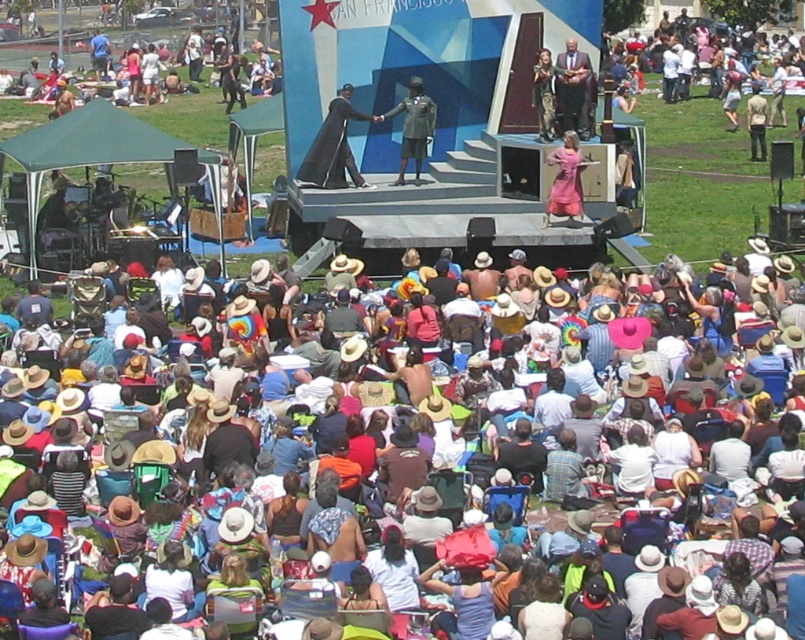
Question: Is brown straw hats at center bigger than metallic silver statue at center?

Choices:
 (A) no
 (B) yes

Answer: (B)

Question: Which object is positioned closest to the metallic silver statue at center?

Choices:
 (A) smooth brown suit at center
 (B) brown straw hats at center
 (C) pink satin dress at center
 (D) black matte robe at center

Answer: (D)

Question: Which object is farther from the camera taking this photo?

Choices:
 (A) pink satin dress at center
 (B) black matte robe at center

Answer: (B)

Question: From the image, what is the correct spatial relationship of black matte robe at center in relation to pink satin dress at center?

Choices:
 (A) left
 (B) right

Answer: (A)

Question: Is metallic silver statue at center smaller than smooth brown suit at center?

Choices:
 (A) yes
 (B) no

Answer: (B)

Question: Which point is closer to the camera taking this photo?

Choices:
 (A) [403, 140]
 (B) [552, 157]
 (C) [566, 83]

Answer: (B)